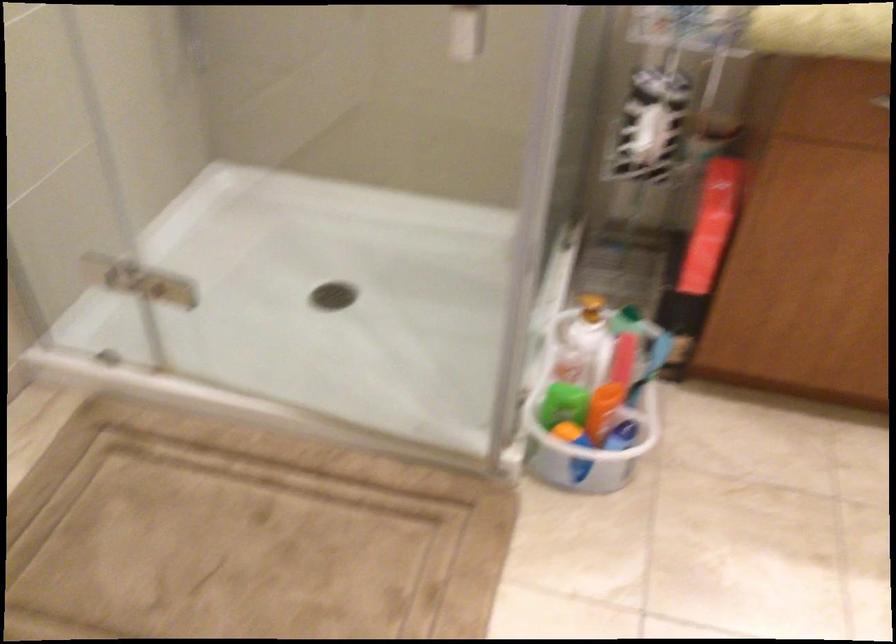
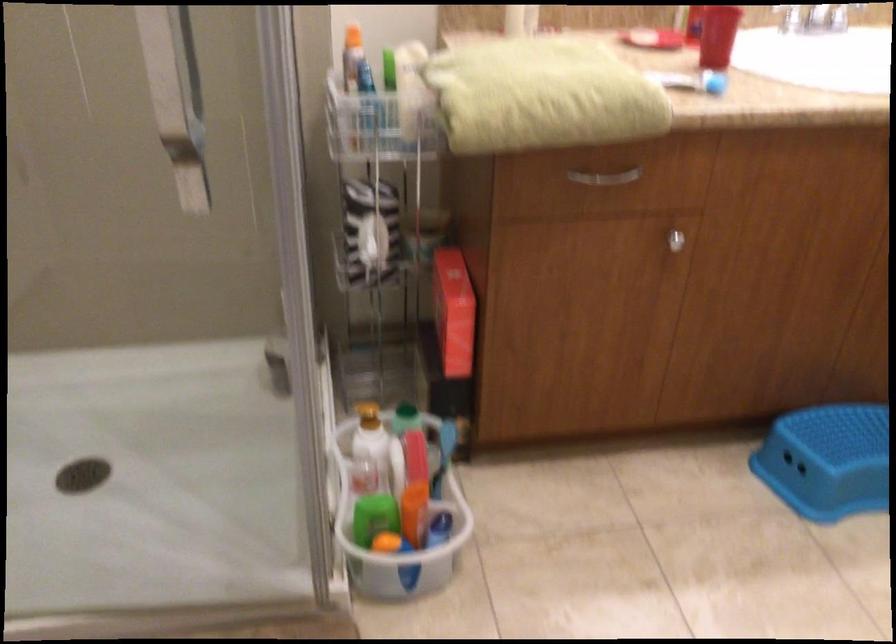
Question: The images are taken continuously from a first-person perspective. In which direction is your viewpoint rotating?

Choices:
 (A) Left
 (B) Right
 (C) Up
 (D) Down

Answer: (B)